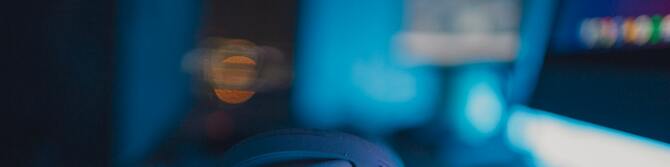
This screenshot has width=670, height=167. What are the coordinates of `black leather piece` in the screenshot? It's located at (321, 149).